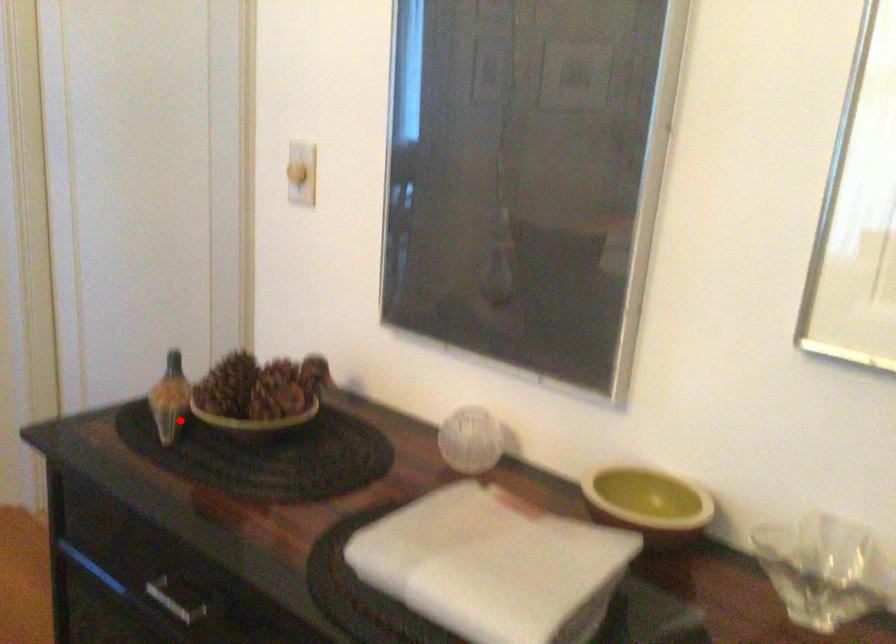
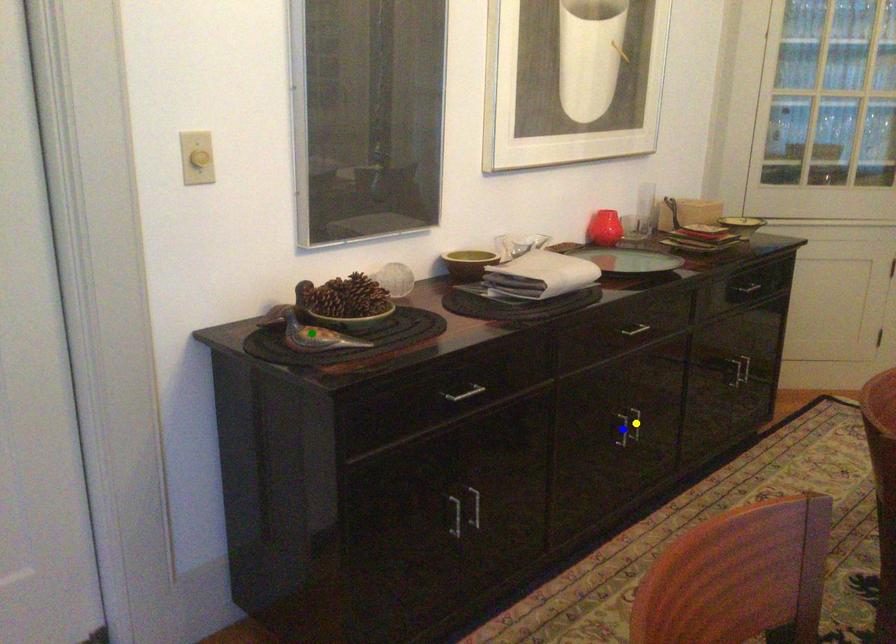
Question: I am providing you with two images of the same scene from different viewpoints. A red point is marked on the first image. You are given multiple points on the second image. Can you choose the point in image 2 that corresponds to the point in image 1?

Choices:
 (A) green point
 (B) yellow point
 (C) blue point

Answer: (A)